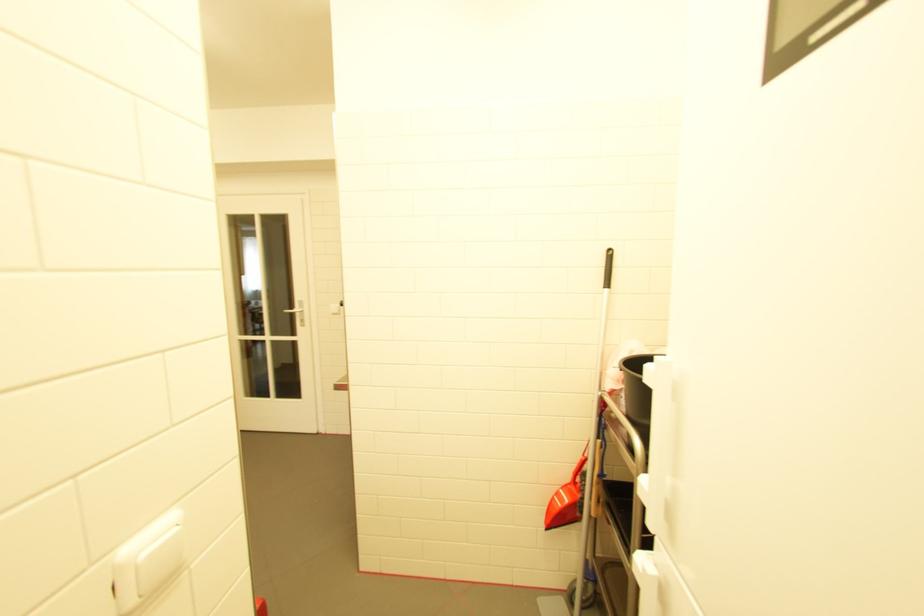
Locate an element on the screen. metal door handle is located at coordinates (294, 312).